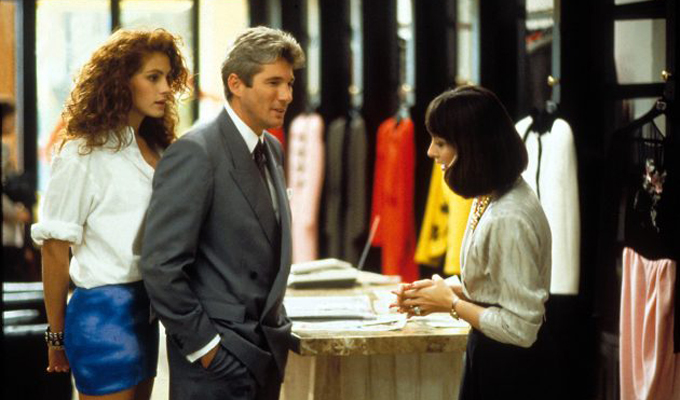
Where is `wooden desk`? wooden desk is located at coordinates (406, 340).